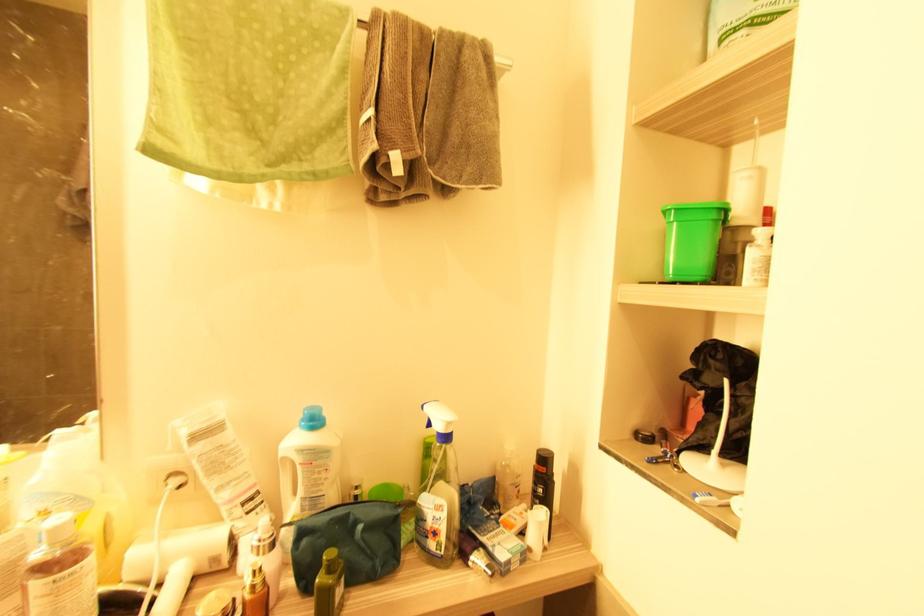
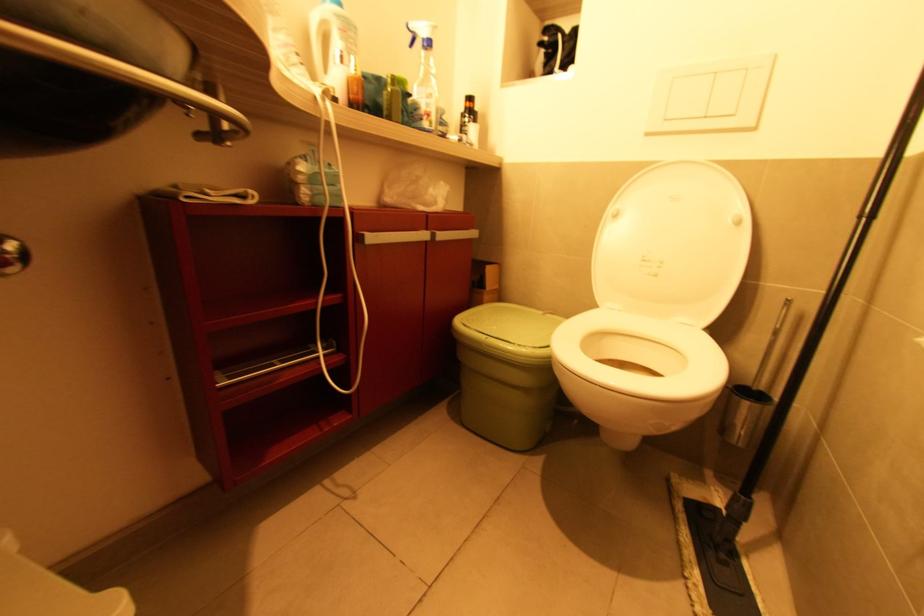
The point at (439, 432) is marked in the first image. Where is the corresponding point in the second image?

(427, 42)